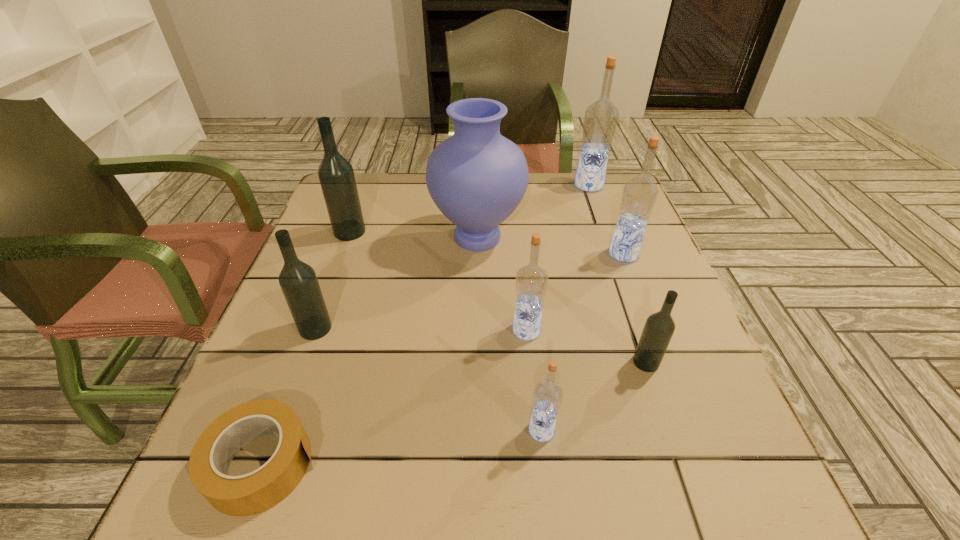
The height and width of the screenshot is (540, 960). What are the coordinates of `blue vodka that is the second closest one to the biggest black vodka` in the screenshot? It's located at (600, 121).

Identify which black vodka is the closest to the second smallest black vodka. Please provide its 2D coordinates. Your answer should be formatted as a tuple, i.e. [(x, y)], where the tuple contains the x and y coordinates of a point satisfying the conditions above.

[(336, 175)]

Find the location of a particular element. The image size is (960, 540). the closest black vodka to the farthest blue vodka is located at coordinates (658, 330).

This screenshot has height=540, width=960. In order to click on free location that satisfies the following two spatial constraints: 1. on the back side of the farthest vodka; 2. on the right side of the second nearest black vodka in this screenshot , I will do `click(368, 185)`.

Image resolution: width=960 pixels, height=540 pixels. Identify the location of vacant point that satisfies the following two spatial constraints: 1. on the front side of the nearest black vodka; 2. on the right side of the second smallest black vodka. (303, 362).

Image resolution: width=960 pixels, height=540 pixels. I want to click on free spot that satisfies the following two spatial constraints: 1. on the back side of the nearest black vodka; 2. on the left side of the nearest vodka, so click(x=534, y=362).

Where is `free space that satisfies the following two spatial constraints: 1. on the front side of the smallest blue vodka; 2. on the left side of the second smallest black vodka`? free space that satisfies the following two spatial constraints: 1. on the front side of the smallest blue vodka; 2. on the left side of the second smallest black vodka is located at coordinates (278, 430).